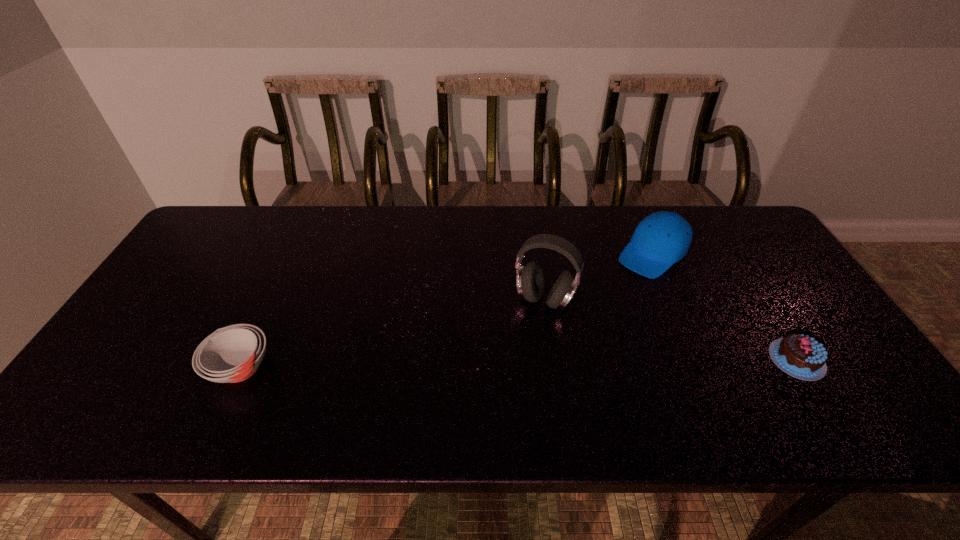
The height and width of the screenshot is (540, 960). I want to click on vacant space on the desktop that is between the leftmost object and the chocolate cake and is positioned on the front-facing side of the cap, so click(534, 363).

Find the location of a particular element. The height and width of the screenshot is (540, 960). vacant spot on the desktop that is between the soup bowl and the rightmost object and is positioned on the ear cups of the third object from right to left is located at coordinates (509, 364).